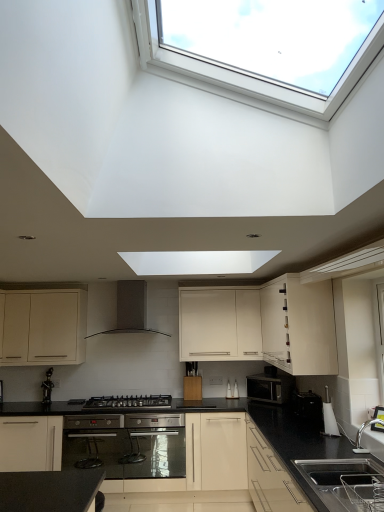
You are a GUI agent. You are given a task and a screenshot of the screen. Output one action in this format:
    pyautogui.click(x=<x>, y=<y>)
    Task: Click on the black matte range hood at center
    The height and width of the screenshot is (512, 384).
    Given the screenshot: What is the action you would take?
    pyautogui.click(x=131, y=309)

The image size is (384, 512). I want to click on black matte gas stove at center, so click(129, 402).

Describe the element at coordinates (157, 446) in the screenshot. I see `satin stainless steel oven at center` at that location.

Identify the location of white plastic kettle at lower right, the third appliance viewed from the back. This screenshot has height=512, width=384. (329, 417).

Considering the positions of objects matte black microwave at center, the first appliance in the back-to-front sequence, and white glossy cabinet at upper right, positioned as the first cabinetry in right-to-left order, in the image provided, who is more to the right, matte black microwave at center, the first appliance in the back-to-front sequence, or white glossy cabinet at upper right, positioned as the first cabinetry in right-to-left order,?

white glossy cabinet at upper right, positioned as the first cabinetry in right-to-left order.

Consider the image. Does matte black microwave at center, the first appliance in the back-to-front sequence, have a greater width compared to white glossy cabinet at upper right, positioned as the first cabinetry in right-to-left order?

No.

From the picture: From the image's perspective, is matte black microwave at center, the 3th appliance viewed from the front, above white glossy cabinet at upper right, acting as the third cabinetry starting from the left?

No, from the image's perspective, matte black microwave at center, the 3th appliance viewed from the front, is not on top of white glossy cabinet at upper right, acting as the third cabinetry starting from the left.

Is black plastic toaster at lower right, the second appliance when ordered from front to back, aimed at white plastic kettle at lower right, the third appliance viewed from the back?

No, black plastic toaster at lower right, the second appliance when ordered from front to back, does not turn towards white plastic kettle at lower right, the third appliance viewed from the back.

Considering the sizes of black plastic toaster at lower right, the second appliance when ordered from front to back, and white plastic kettle at lower right, acting as the first appliance starting from the front, in the image, is black plastic toaster at lower right, the second appliance when ordered from front to back, wider or thinner than white plastic kettle at lower right, acting as the first appliance starting from the front,?

black plastic toaster at lower right, the second appliance when ordered from front to back, is wider than white plastic kettle at lower right, acting as the first appliance starting from the front.

Considering the sizes of objects black plastic toaster at lower right, which is counted as the second appliance, starting from the back, and white plastic kettle at lower right, the third appliance viewed from the back, in the image provided, who is bigger, black plastic toaster at lower right, which is counted as the second appliance, starting from the back, or white plastic kettle at lower right, the third appliance viewed from the back,?

With larger size is white plastic kettle at lower right, the third appliance viewed from the back.

Are black plastic toaster at lower right, the second appliance when ordered from front to back, and white plastic kettle at lower right, the third appliance viewed from the back, located far from each other?

No.

Is black matte range hood at center at the left side of white matte cabinet at center, the 2th cabinetry from the left?

Yes.

Would you say black matte range hood at center contains white matte cabinet at center, which is the 2th cabinetry from right to left?

No, white matte cabinet at center, which is the 2th cabinetry from right to left, is not surrounded by black matte range hood at center.

Could you tell me if white plastic kettle at lower right, acting as the first appliance starting from the front, is turned towards black plastic toaster at lower right, which is counted as the second appliance, starting from the back?

No, white plastic kettle at lower right, acting as the first appliance starting from the front, does not turn towards black plastic toaster at lower right, which is counted as the second appliance, starting from the back.

Could you measure the distance between white plastic kettle at lower right, the third appliance viewed from the back, and black plastic toaster at lower right, which is counted as the second appliance, starting from the back?

They are 12.62 inches apart.

Choose the correct answer: Is white plastic kettle at lower right, the third appliance viewed from the back, inside black plastic toaster at lower right, the second appliance when ordered from front to back, or outside it?

white plastic kettle at lower right, the third appliance viewed from the back, is located beyond the bounds of black plastic toaster at lower right, the second appliance when ordered from front to back.

Is white plastic kettle at lower right, acting as the first appliance starting from the front, positioned behind black plastic toaster at lower right, the second appliance when ordered from front to back?

No, the depth of white plastic kettle at lower right, acting as the first appliance starting from the front, is less than that of black plastic toaster at lower right, the second appliance when ordered from front to back.

Does white glossy cabinet at upper right, acting as the third cabinetry starting from the left, have a smaller size compared to black matte gas stove at center?

No, white glossy cabinet at upper right, acting as the third cabinetry starting from the left, is not smaller than black matte gas stove at center.

Considering the relative positions of white glossy cabinet at upper right, positioned as the first cabinetry in right-to-left order, and black matte gas stove at center in the image provided, is white glossy cabinet at upper right, positioned as the first cabinetry in right-to-left order, to the right of black matte gas stove at center from the viewer's perspective?

Indeed, white glossy cabinet at upper right, positioned as the first cabinetry in right-to-left order, is positioned on the right side of black matte gas stove at center.

From a real-world perspective, is white glossy cabinet at upper right, positioned as the first cabinetry in right-to-left order, beneath black matte gas stove at center?

Actually, white glossy cabinet at upper right, positioned as the first cabinetry in right-to-left order, is physically above black matte gas stove at center in the real world.

Considering the relative sizes of white glossy cabinet at upper right, positioned as the first cabinetry in right-to-left order, and black matte gas stove at center in the image provided, is white glossy cabinet at upper right, positioned as the first cabinetry in right-to-left order, taller than black matte gas stove at center?

Indeed, white glossy cabinet at upper right, positioned as the first cabinetry in right-to-left order, has a greater height compared to black matte gas stove at center.

Is white plastic kettle at lower right, acting as the first appliance starting from the front, beside black matte gas stove at center?

white plastic kettle at lower right, acting as the first appliance starting from the front, and black matte gas stove at center are not in contact.

Considering the sizes of white plastic kettle at lower right, the third appliance viewed from the back, and black matte gas stove at center in the image, is white plastic kettle at lower right, the third appliance viewed from the back, wider or thinner than black matte gas stove at center?

Clearly, white plastic kettle at lower right, the third appliance viewed from the back, has less width compared to black matte gas stove at center.

What's the angular difference between white plastic kettle at lower right, acting as the first appliance starting from the front, and black matte gas stove at center's facing directions?

The facing directions of white plastic kettle at lower right, acting as the first appliance starting from the front, and black matte gas stove at center are 90.6 degrees apart.

In the scene shown: Which is less distant, (326, 404) or (126, 398)?

Point (326, 404) is positioned closer to the camera compared to point (126, 398).

From their relative heights in the image, would you say white matte cabinet at center, the 2th cabinetry from the left, is taller or shorter than black granite sink at lower right?

Considering their sizes, white matte cabinet at center, the 2th cabinetry from the left, has more height than black granite sink at lower right.

From a real-world perspective, is white matte cabinet at center, the 2th cabinetry from the left, on black granite sink at lower right?

Indeed, from a real-world perspective, white matte cabinet at center, the 2th cabinetry from the left, stands above black granite sink at lower right.

Are white matte cabinet at center, the 2th cabinetry from the left, and black granite sink at lower right making contact?

No, white matte cabinet at center, the 2th cabinetry from the left, is not making contact with black granite sink at lower right.

Where is `cabinetry that is in front of the matte black microwave at center, the 3th appliance viewed from the front`? cabinetry that is in front of the matte black microwave at center, the 3th appliance viewed from the front is located at coordinates (299, 326).

Image resolution: width=384 pixels, height=512 pixels. Find the location of `appliance that is the 2nd one above the black plastic toaster at lower right, the second appliance when ordered from front to back (from a real-world perspective)`. appliance that is the 2nd one above the black plastic toaster at lower right, the second appliance when ordered from front to back (from a real-world perspective) is located at coordinates (329, 417).

Based on their spatial positions, is white plastic kettle at lower right, the third appliance viewed from the back, or black plastic toaster at lower right, the second appliance when ordered from front to back, further from black matte range hood at center?

Based on the image, white plastic kettle at lower right, the third appliance viewed from the back, appears to be further to black matte range hood at center.

Which object lies further to the anchor point matte black microwave at center, the first appliance in the back-to-front sequence, black matte range hood at center or white plastic kettle at lower right, acting as the first appliance starting from the front?

black matte range hood at center lies further to matte black microwave at center, the first appliance in the back-to-front sequence, than the other object.

From the image, which object appears to be farther from matte black microwave at center, the first appliance in the back-to-front sequence, matte white cabinet at lower left, which is the third cabinetry from right to left, or white plastic kettle at lower right, the third appliance viewed from the back?

Based on the image, matte white cabinet at lower left, which is the third cabinetry from right to left, appears to be further to matte black microwave at center, the first appliance in the back-to-front sequence.

Based on the photo, based on their spatial positions, is black matte range hood at center or black granite sink at lower right further from matte white cabinet at lower left, which is the third cabinetry from right to left?

The object further to matte white cabinet at lower left, which is the third cabinetry from right to left, is black granite sink at lower right.

From the image, which object appears to be farther from white glossy cabinet at upper right, positioned as the first cabinetry in right-to-left order, black matte gas stove at center or white plastic kettle at lower right, acting as the first appliance starting from the front?

black matte gas stove at center is further to white glossy cabinet at upper right, positioned as the first cabinetry in right-to-left order.

Based on their spatial positions, is black matte range hood at center or white glossy cabinet at upper right, acting as the third cabinetry starting from the left, further from black matte gas stove at center?

white glossy cabinet at upper right, acting as the third cabinetry starting from the left, is positioned further to the anchor black matte gas stove at center.

Considering their positions, is white plastic kettle at lower right, the third appliance viewed from the back, positioned further to black matte range hood at center than matte white cabinet at lower left, which is the third cabinetry from right to left?

Based on the image, white plastic kettle at lower right, the third appliance viewed from the back, appears to be further to black matte range hood at center.

Looking at the image, which one is located closer to white glossy cabinet at upper right, acting as the third cabinetry starting from the left, black plastic toaster at lower right, the second appliance when ordered from front to back, or white plastic kettle at lower right, acting as the first appliance starting from the front?

white plastic kettle at lower right, acting as the first appliance starting from the front, lies closer to white glossy cabinet at upper right, acting as the third cabinetry starting from the left, than the other object.

The width and height of the screenshot is (384, 512). I want to click on oven between matte white cabinet at lower left, which is the third cabinetry from right to left, and black plastic toaster at lower right, the second appliance when ordered from front to back, so click(x=157, y=446).

The image size is (384, 512). Find the location of `gas stove between black granite sink at lower right and matte white cabinet at lower left, which is the third cabinetry from right to left, along the z-axis`. gas stove between black granite sink at lower right and matte white cabinet at lower left, which is the third cabinetry from right to left, along the z-axis is located at coordinates (129, 402).

Where is `appliance between black matte range hood at center and black plastic toaster at lower right, the second appliance when ordered from front to back, in the horizontal direction`? appliance between black matte range hood at center and black plastic toaster at lower right, the second appliance when ordered from front to back, in the horizontal direction is located at coordinates (270, 388).

Find the location of a particular element. The width and height of the screenshot is (384, 512). oven positioned between black granite sink at lower right and matte white cabinet at lower left, which is the third cabinetry from right to left, from near to far is located at coordinates (157, 446).